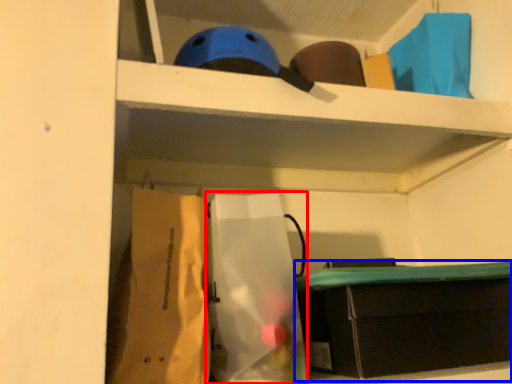
Question: Which object is further to the camera taking this photo, paper bag (highlighted by a red box) or furniture (highlighted by a blue box)?

Choices:
 (A) paper bag
 (B) furniture

Answer: (B)